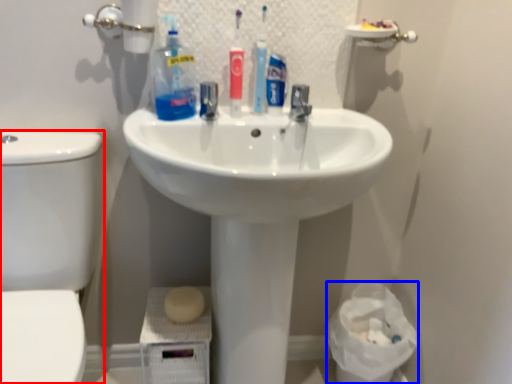
Question: Which object is further to the camera taking this photo, toilet bowl (highlighted by a red box) or toilet paper (highlighted by a blue box)?

Choices:
 (A) toilet bowl
 (B) toilet paper

Answer: (B)